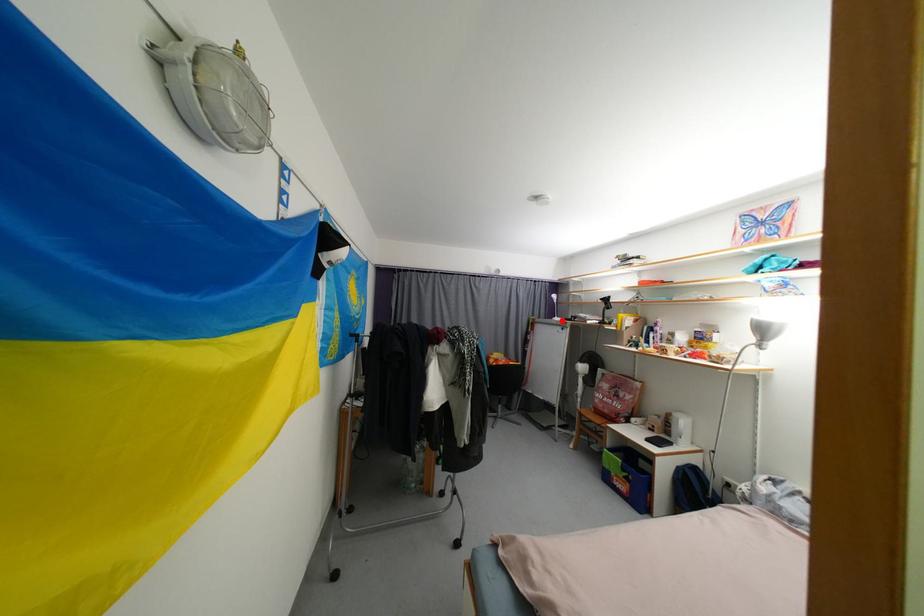
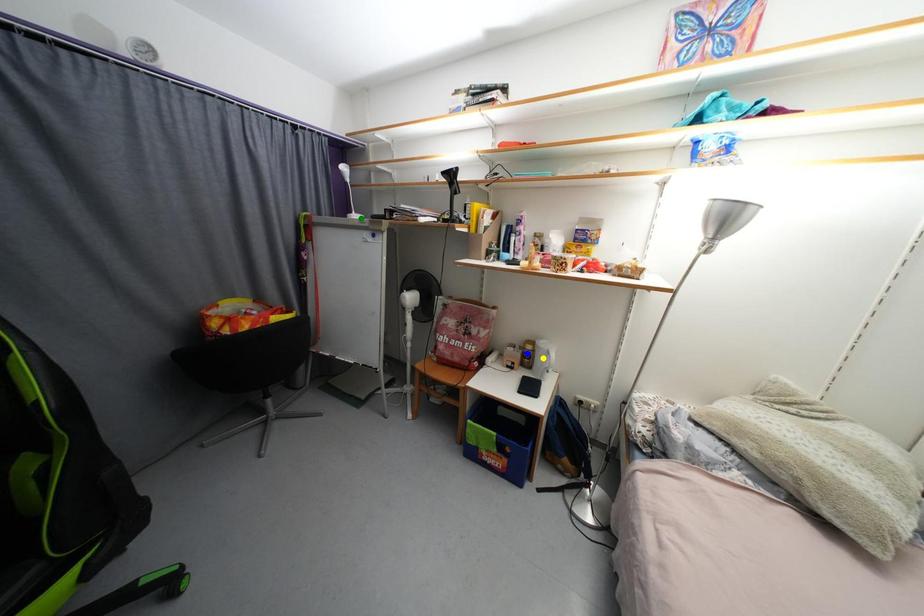
Question: I am providing you with two images of the same scene from different viewpoints. A red point is marked on the first image. You are given multiple points on the second image. Which point in image 2 is actually the same real-world point as the red point in image 1?

Choices:
 (A) blue point
 (B) green point
 (C) yellow point

Answer: (B)